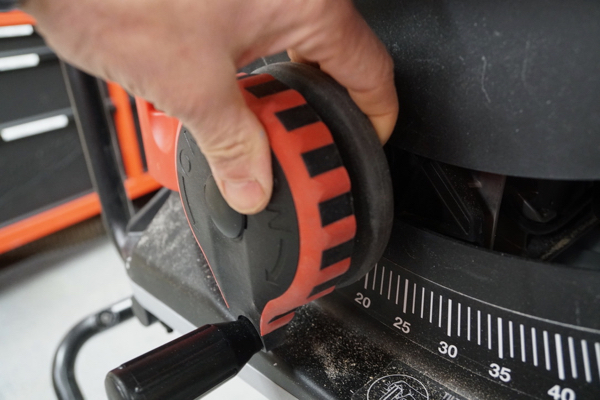
Where is `tool storage chest`? The width and height of the screenshot is (600, 400). tool storage chest is located at coordinates (37, 95).